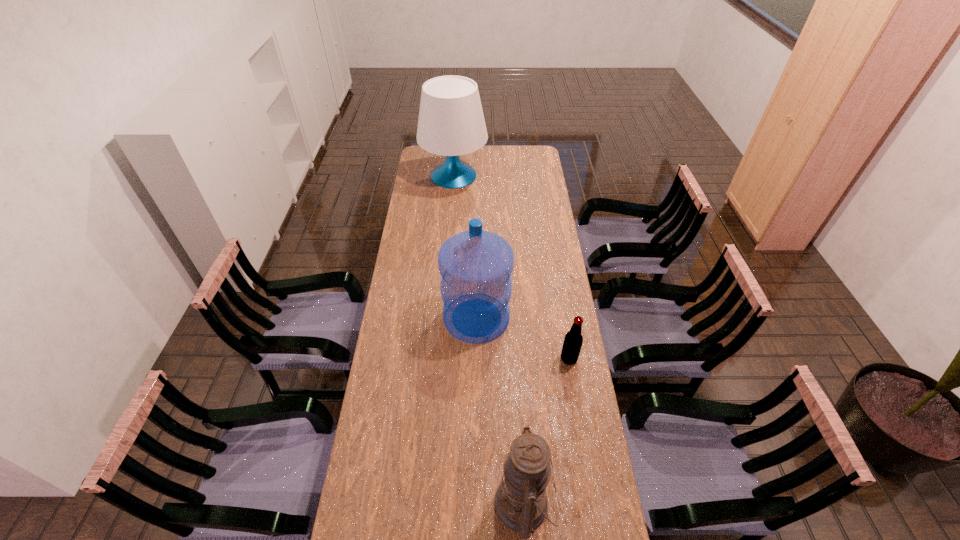
The height and width of the screenshot is (540, 960). I want to click on vacant space that satisfies the following two spatial constraints: 1. on the front-facing side of the second farthest object; 2. on the right side of the table lamp, so click(444, 318).

The image size is (960, 540). What are the coordinates of `vacant area that satisfies the following two spatial constraints: 1. on the front-facing side of the second nearest object; 2. on the left side of the table lamp` in the screenshot? It's located at (441, 359).